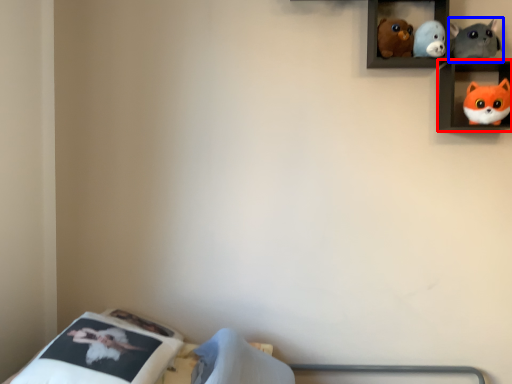
Question: Among these objects, which one is nearest to the camera, shelf (highlighted by a red box) or toy (highlighted by a blue box)?

Choices:
 (A) shelf
 (B) toy

Answer: (A)